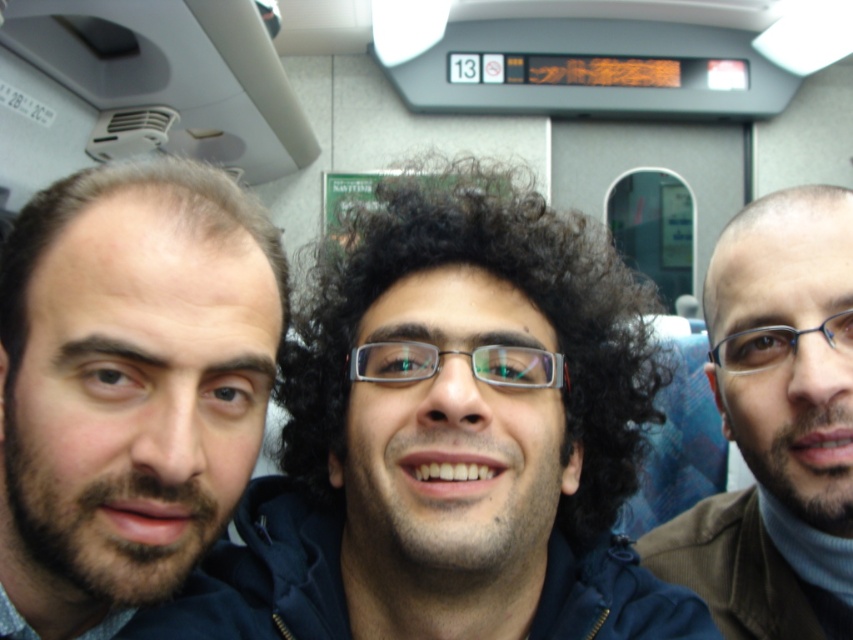
Question: Based on their relative distances, which object is farther from the brown woolen sweater at right?

Choices:
 (A) bearded man at left
 (B) dark blue jacket at center

Answer: (A)

Question: Among these objects, which one is farthest from the camera?

Choices:
 (A) brown woolen sweater at right
 (B) dark blue jacket at center
 (C) bearded man at left

Answer: (A)

Question: Does dark blue jacket at center come in front of brown woolen sweater at right?

Choices:
 (A) yes
 (B) no

Answer: (A)

Question: Is dark blue jacket at center to the right of bearded man at left from the viewer's perspective?

Choices:
 (A) no
 (B) yes

Answer: (B)

Question: Among these objects, which one is nearest to the camera?

Choices:
 (A) dark blue jacket at center
 (B) brown woolen sweater at right

Answer: (A)

Question: Can you confirm if dark blue jacket at center is positioned to the left of brown woolen sweater at right?

Choices:
 (A) yes
 (B) no

Answer: (A)